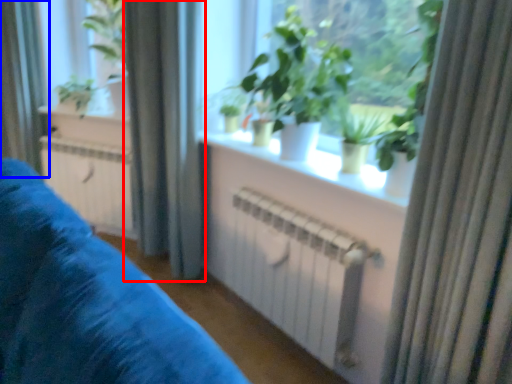
Question: Which object is closer to the camera taking this photo, curtain (highlighted by a red box) or curtain (highlighted by a blue box)?

Choices:
 (A) curtain
 (B) curtain

Answer: (A)